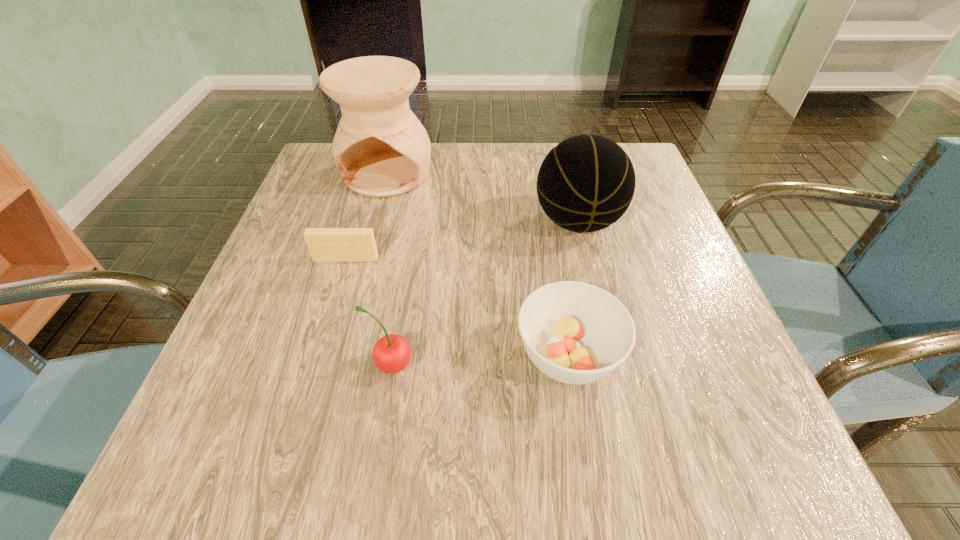
Where is `pottery`? Image resolution: width=960 pixels, height=540 pixels. pottery is located at coordinates (381, 149).

Locate an element on the screen. basketball is located at coordinates (586, 183).

The width and height of the screenshot is (960, 540). Identify the location of the third shortest object. (392, 353).

Find the location of a particular element. soup bowl is located at coordinates (576, 333).

You are a GUI agent. You are given a task and a screenshot of the screen. Output one action in this format:
    pyautogui.click(x=<x>, y=<y>)
    Task: Click on the third farthest object
    The image size is (960, 540).
    Given the screenshot: What is the action you would take?
    pyautogui.click(x=325, y=244)

You are a GUI agent. You are given a task and a screenshot of the screen. Output one action in this format:
    pyautogui.click(x=<x>, y=<y>)
    Task: Click on the videotape
    The height and width of the screenshot is (540, 960).
    Given the screenshot: What is the action you would take?
    pyautogui.click(x=325, y=244)

Locate an element on the screen. vacant space located at the open side of the pottery is located at coordinates (363, 266).

Where is `vacant space located 0.240m on the left of the basketball`? The height and width of the screenshot is (540, 960). vacant space located 0.240m on the left of the basketball is located at coordinates (418, 222).

The image size is (960, 540). Identify the location of free location located on the right of the third tallest object. (531, 366).

Where is `vacant space positioned on the left of the second shortest object`? The width and height of the screenshot is (960, 540). vacant space positioned on the left of the second shortest object is located at coordinates (309, 355).